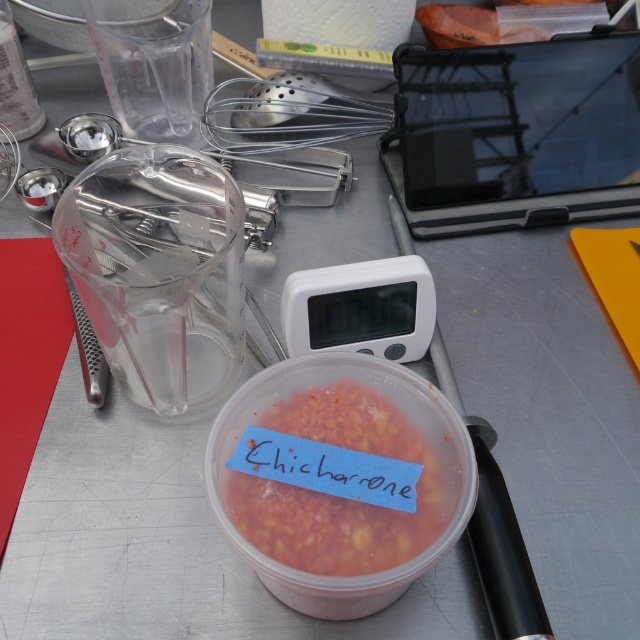
Who is taller, transparent plastic blender at center-left or translucent plastic container at center?

transparent plastic blender at center-left

Can you confirm if transparent plastic blender at center-left is positioned to the left of translucent plastic container at center?

Indeed, transparent plastic blender at center-left is positioned on the left side of translucent plastic container at center.

Is point (160, 266) more distant than point (344, 404)?

Yes, it is behind point (344, 404).

Where is `transparent plastic blender at center-left`? The width and height of the screenshot is (640, 640). transparent plastic blender at center-left is located at coordinates (157, 269).